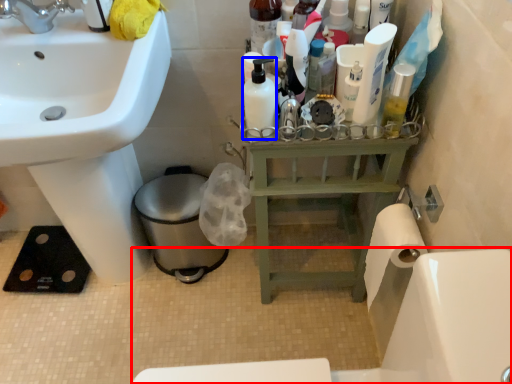
Question: Which point is further to the camera, bath (highlighted by a red box) or mouthwash (highlighted by a blue box)?

Choices:
 (A) bath
 (B) mouthwash

Answer: (B)